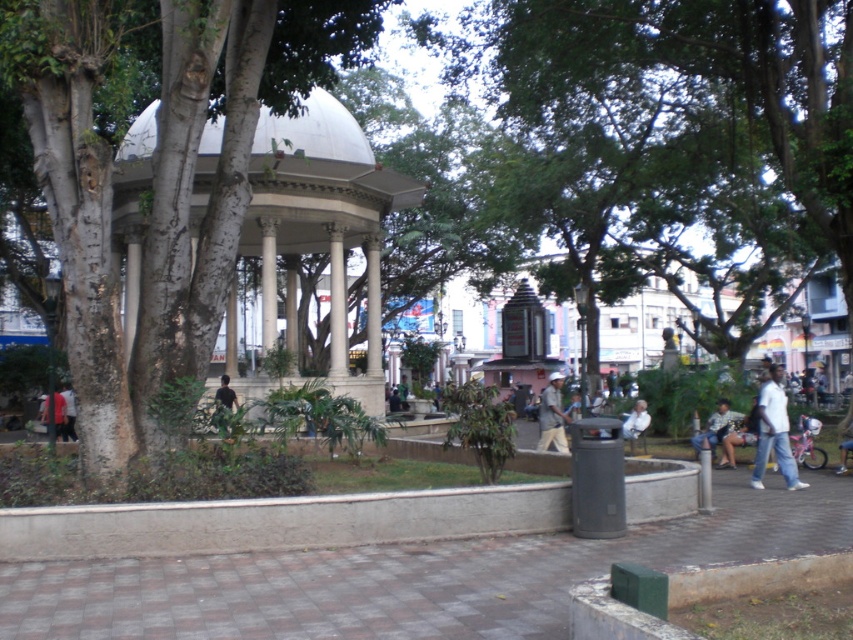
Is white marble gazebo at center wider than dark blue shirt at lower left?

Indeed, white marble gazebo at center has a greater width compared to dark blue shirt at lower left.

Can you confirm if white marble gazebo at center is positioned above dark blue shirt at lower left?

Yes, white marble gazebo at center is above dark blue shirt at lower left.

Where is `white marble gazebo at center`? Image resolution: width=853 pixels, height=640 pixels. white marble gazebo at center is located at coordinates (328, 214).

Between point (547, 426) and point (59, 397), which one is positioned in front?

Positioned in front is point (547, 426).

Locate an element on the screen. light brown fabric shirt at center is located at coordinates (552, 416).

Can you confirm if white marble column at center is bigger than dark blue shirt at lower left?

Indeed, white marble column at center has a larger size compared to dark blue shirt at lower left.

Does point (270, 312) come closer to viewer compared to point (59, 403)?

No, (270, 312) is behind (59, 403).

You are a GUI agent. You are given a task and a screenshot of the screen. Output one action in this format:
    pyautogui.click(x=<x>, y=<y>)
    Task: Click on the white marble column at center
    
    Given the screenshot: What is the action you would take?
    pyautogui.click(x=268, y=282)